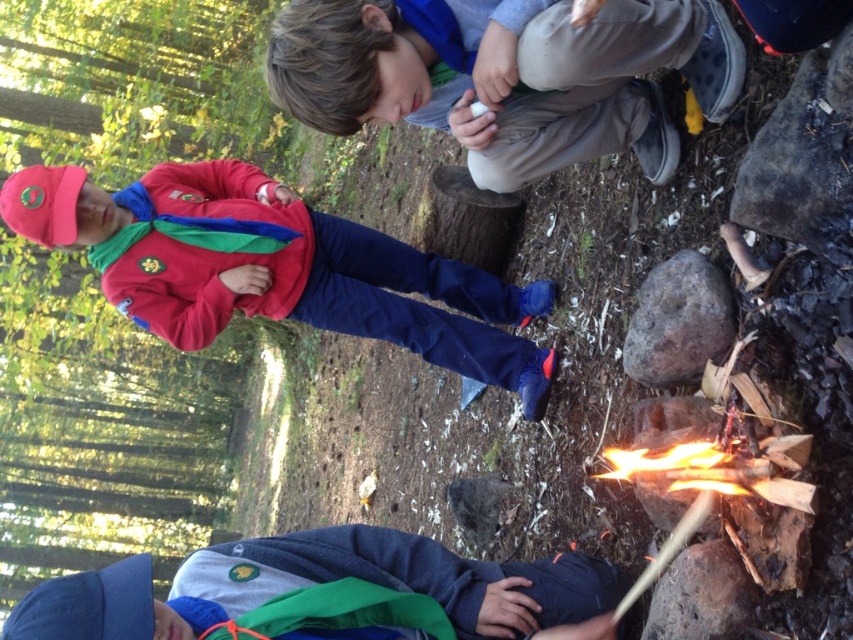
You are a photographer trying to capture a candid shot of the gray cotton pants at upper right and the red fleece jacket at left. If your camera has a maximum focus range of 35 inches, will you be able to capture both subjects in focus at the same time?

The distance between the gray cotton pants at upper right and the red fleece jacket at left is 34.52 inches, which is within the camera maximum focus range of 35 inches. Therefore, you can capture both subjects in focus simultaneously.

You are a child standing near the campfire and want to reach both the green leafy tree at upper left and the red fleece jacket at left. Which object is closer to you?

The red fleece jacket at left is closer to you because the green leafy tree at upper left is further away from you.